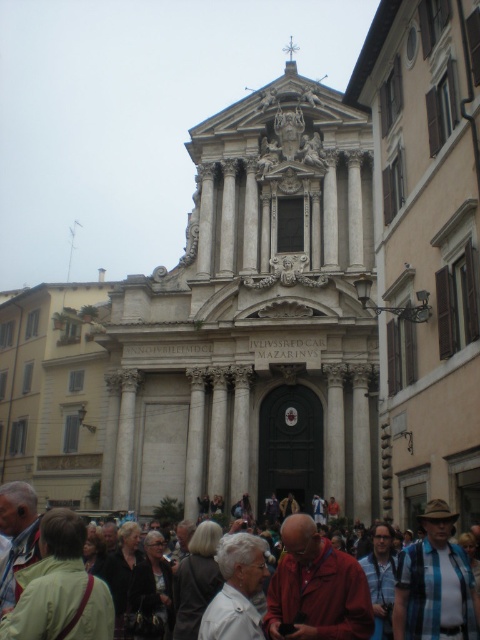
From the picture: Does dark gray sweater at center have a greater height compared to white marble column at center?

In fact, dark gray sweater at center may be shorter than white marble column at center.

Does point (200, 548) come closer to viewer compared to point (194, 404)?

Yes, point (200, 548) is in front of point (194, 404).

Find the location of a particular element. The height and width of the screenshot is (640, 480). dark gray sweater at center is located at coordinates (195, 579).

In order to click on dark gray sweater at center in this screenshot , I will do `click(195, 579)`.

Does blue plaid shirt at lower center have a greater height compared to dark gray sweater at center?

Yes, blue plaid shirt at lower center is taller than dark gray sweater at center.

This screenshot has height=640, width=480. What do you see at coordinates (434, 582) in the screenshot?
I see `blue plaid shirt at lower center` at bounding box center [434, 582].

Locate an element on the screen. The height and width of the screenshot is (640, 480). blue plaid shirt at lower center is located at coordinates (434, 582).

Does dark gray sweater at center have a smaller size compared to blue plaid shirt at center?

Actually, dark gray sweater at center might be larger than blue plaid shirt at center.

Can you confirm if dark gray sweater at center is shorter than blue plaid shirt at center?

No, dark gray sweater at center is not shorter than blue plaid shirt at center.

Between point (196, 563) and point (385, 538), which one is positioned behind?

The point (385, 538) is more distant.

Where is `dark gray sweater at center`? dark gray sweater at center is located at coordinates (195, 579).